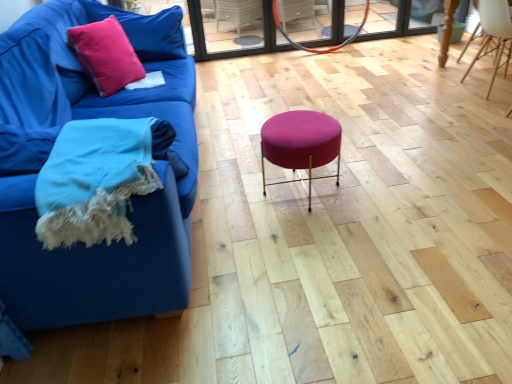
Question: Can you confirm if matte pink cushion at upper left is bigger than pink velvet pillow at upper left?

Choices:
 (A) no
 (B) yes

Answer: (A)

Question: Is matte pink cushion at upper left outside of pink velvet pillow at upper left?

Choices:
 (A) yes
 (B) no

Answer: (A)

Question: From a real-world perspective, is matte pink cushion at upper left on top of pink velvet pillow at upper left?

Choices:
 (A) yes
 (B) no

Answer: (B)

Question: Is matte pink cushion at upper left positioned in front of pink velvet pillow at upper left?

Choices:
 (A) yes
 (B) no

Answer: (A)

Question: Is pink velvet pillow at upper left at the back of matte pink cushion at upper left?

Choices:
 (A) yes
 (B) no

Answer: (B)

Question: From a real-world perspective, is matte pink cushion at upper left located beneath pink velvet pillow at upper left?

Choices:
 (A) no
 (B) yes

Answer: (B)

Question: Could you tell me if transparent glass door at upper center is turned towards white wood chair at upper right?

Choices:
 (A) yes
 (B) no

Answer: (A)

Question: From a real-world perspective, is transparent glass door at upper center beneath white wood chair at upper right?

Choices:
 (A) no
 (B) yes

Answer: (A)

Question: From a real-world perspective, does transparent glass door at upper center stand above white wood chair at upper right?

Choices:
 (A) yes
 (B) no

Answer: (A)

Question: From the image's perspective, is transparent glass door at upper center on top of white wood chair at upper right?

Choices:
 (A) yes
 (B) no

Answer: (A)

Question: Is transparent glass door at upper center smaller than white wood chair at upper right?

Choices:
 (A) yes
 (B) no

Answer: (B)

Question: Considering the relative sizes of transparent glass door at upper center and white wood chair at upper right in the image provided, is transparent glass door at upper center wider than white wood chair at upper right?

Choices:
 (A) no
 (B) yes

Answer: (A)

Question: Does pink velvet pillow at upper left lie in front of woolen blue blanket at lower left?

Choices:
 (A) no
 (B) yes

Answer: (A)